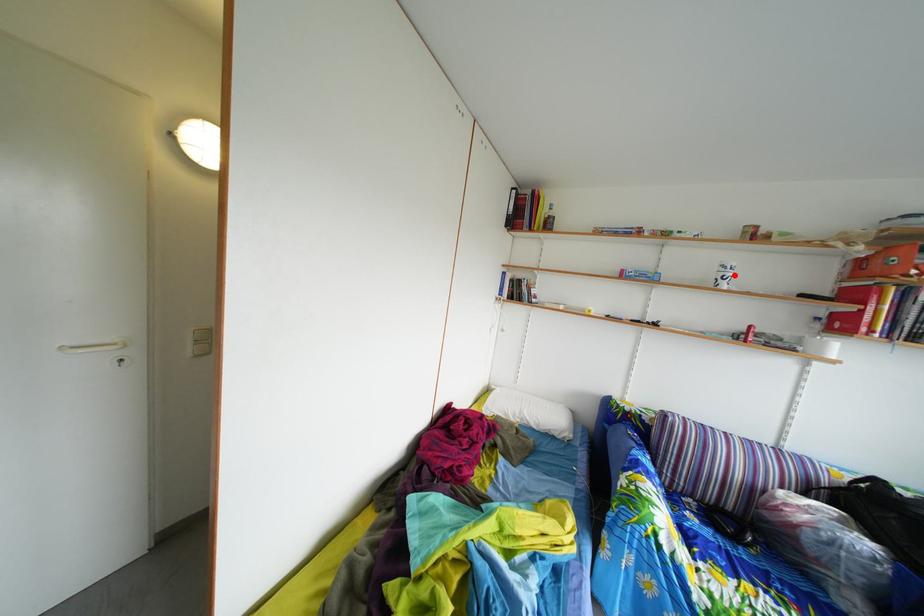
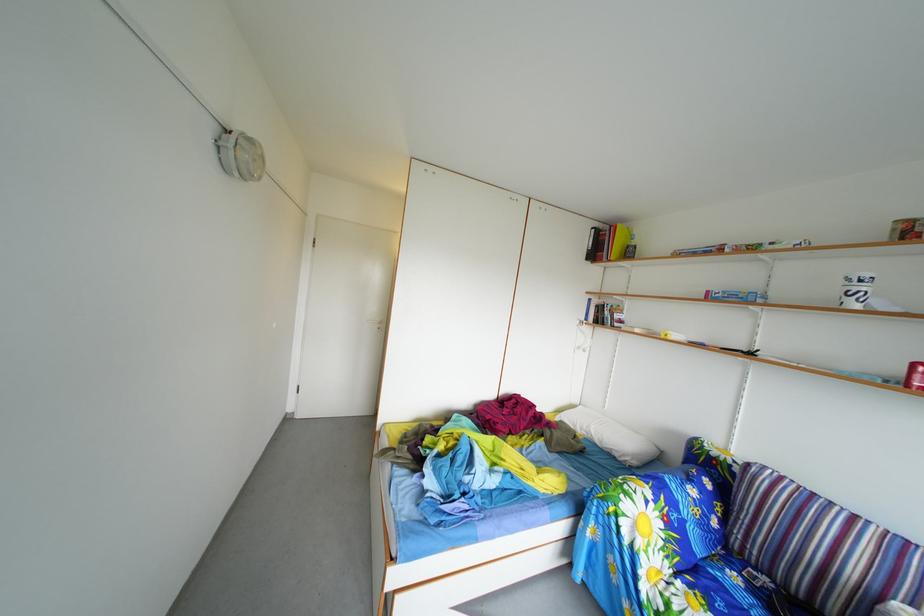
Where in the second image is the point corresponding to the highlighted location from the first image?

(859, 288)